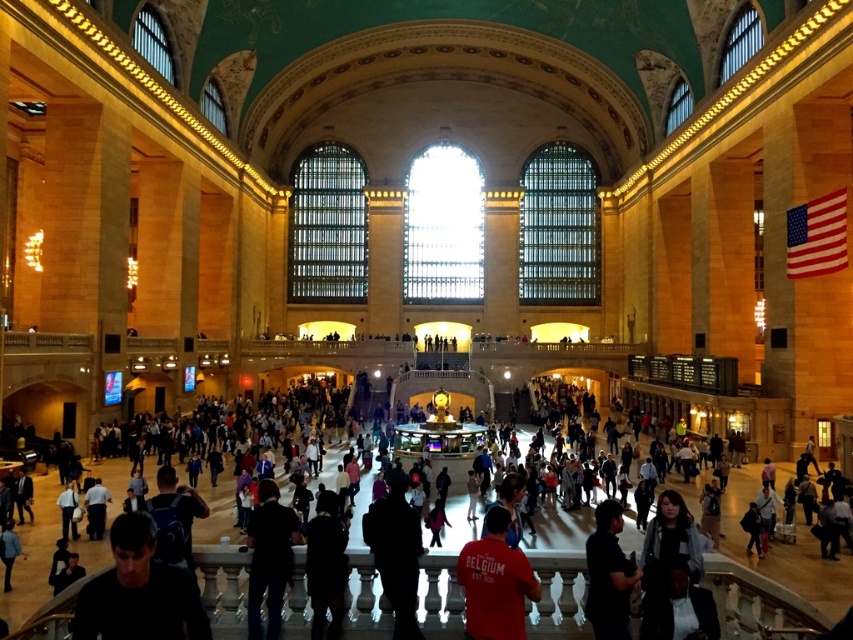
Question: Which point is farther from the camera taking this photo?

Choices:
 (A) (515, 580)
 (B) (259, 502)

Answer: (B)

Question: Which of the following is the closest to the observer?

Choices:
 (A) (254, 529)
 (B) (396, 499)

Answer: (A)

Question: Does dark blue shirt at center have a lesser width compared to red t-shirt at center?

Choices:
 (A) no
 (B) yes

Answer: (A)

Question: Which object is closer to the camera taking this photo?

Choices:
 (A) dark blue shirt at lower right
 (B) dark blue jacket at lower left

Answer: (A)

Question: Can you confirm if dark gray shirt at lower left is positioned above red t-shirt at center?

Choices:
 (A) yes
 (B) no

Answer: (A)

Question: Observing the image, what is the correct spatial positioning of dark gray shirt at lower left in reference to dark blue jacket at lower left?

Choices:
 (A) right
 (B) left

Answer: (B)